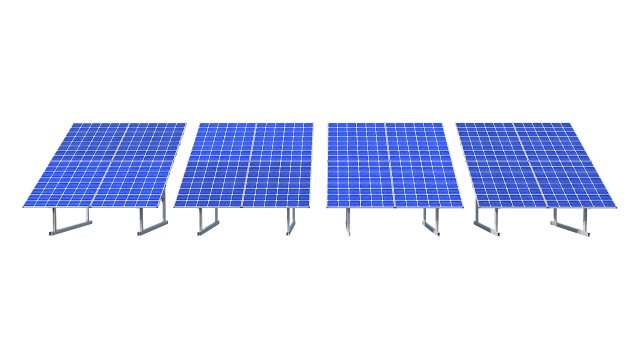
Where is `stands`? This screenshot has height=360, width=640. stands is located at coordinates (60, 229), (147, 225), (203, 225), (285, 225), (349, 228), (436, 230), (495, 230), (585, 230).